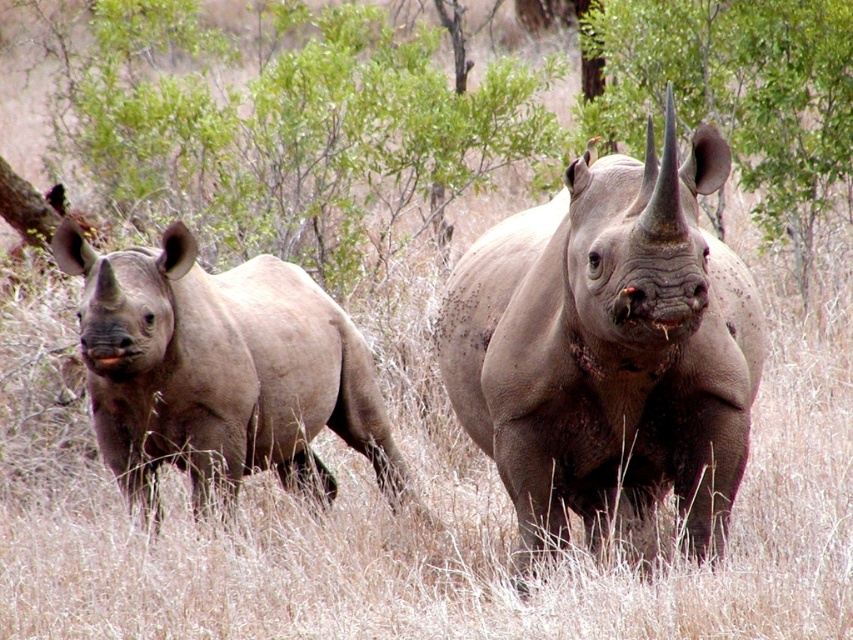
Is gray textured rhino at center to the right of matte gray rhino at left from the viewer's perspective?

Correct, you'll find gray textured rhino at center to the right of matte gray rhino at left.

Who is more forward, (631, 378) or (96, 252)?

Positioned in front is point (631, 378).

The height and width of the screenshot is (640, 853). I want to click on gray textured rhino at center, so click(608, 346).

This screenshot has width=853, height=640. Identify the location of gray textured rhino at center. (608, 346).